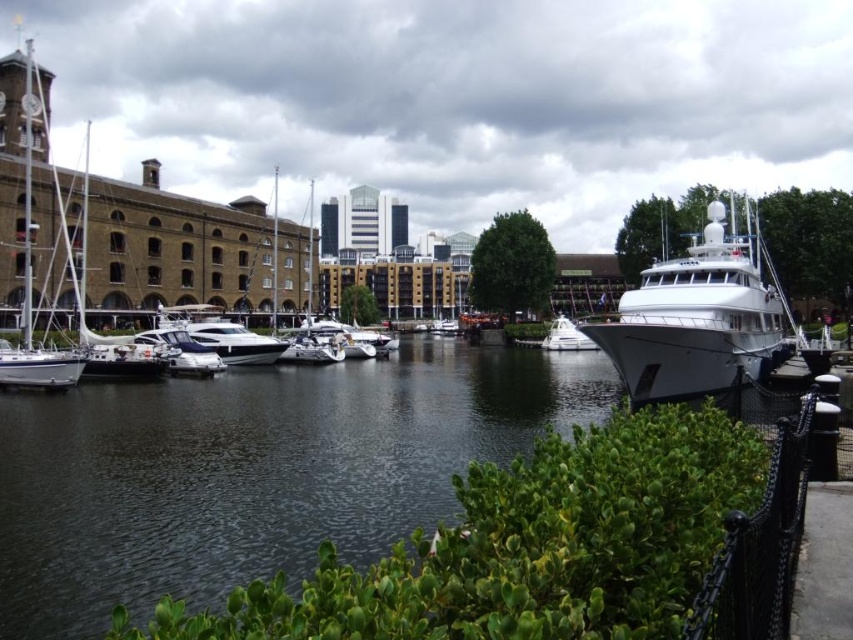
You are a photographer planning to take a photo of the dark blue water at center and the shiny white yacht at center. Based on their relative sizes in the image, which object would appear larger in the final photo?

The dark blue water at center appears larger in the photo because it is much taller than the shiny white yacht at center.

You are a boat owner planning to dock your new vessel in this marina. You have two options for docking spots near the white glossy yacht at right and the white glossy boat at center. Considering their sizes, which docking spot would require more space to accommodate your boat?

The docking spot near the white glossy yacht at right would require more space because the white glossy yacht at right is larger in size compared to the white glossy boat at center.

You are standing at the camera position in the marina scene. There is a point marked at coordinates point (656,316). Can you reach this point without moving more than 50 meters?

The point (656,316) is 56.93 meters away from the camera, so you cannot reach it without moving more than 50 meters.